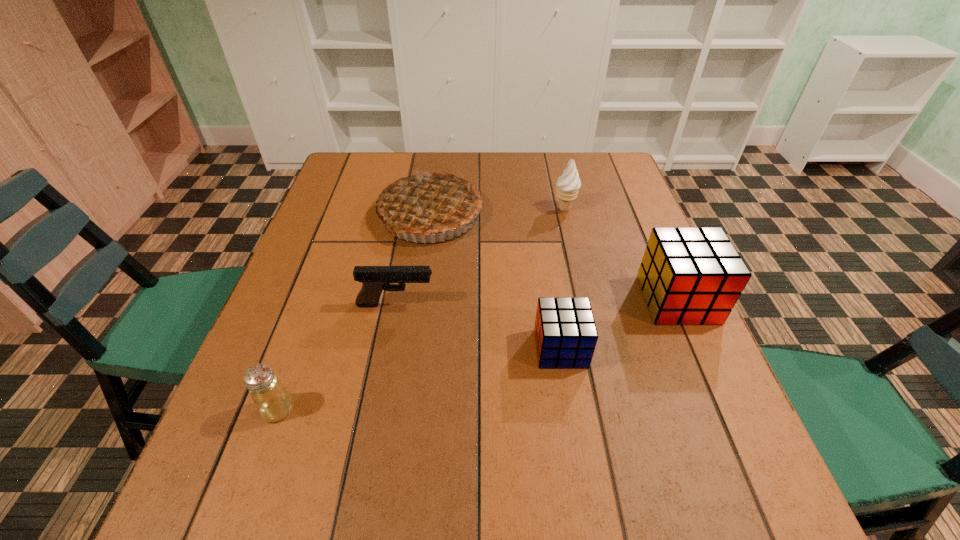
Please point a vacant point for placing a cube on the left. Please provide its 2D coordinates. Your answer should be formatted as a tuple, i.e. [(x, y)], where the tuple contains the x and y coordinates of a point satisfying the conditions above.

[(416, 409)]